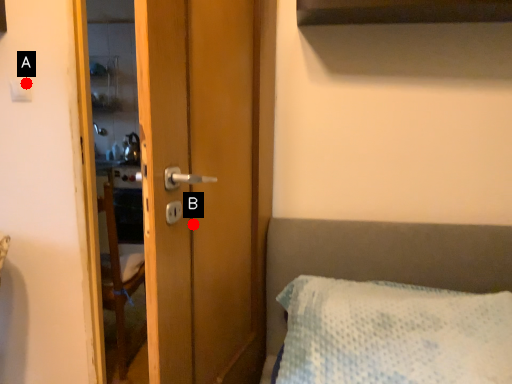
Question: Two points are circled on the image, labeled by A and B beside each circle. Which point is closer to the camera taking this photo?

Choices:
 (A) A is closer
 (B) B is closer

Answer: (B)